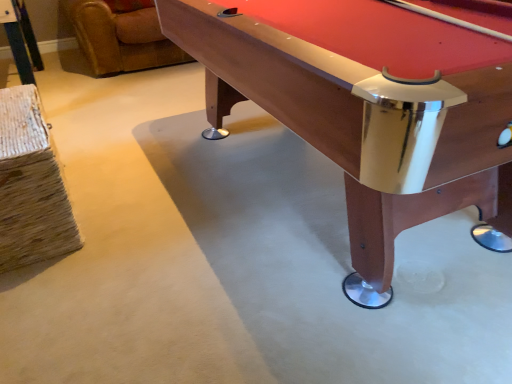
The image size is (512, 384). In order to click on wooden pool table at center in this screenshot , I will do `click(366, 110)`.

What do you see at coordinates (366, 110) in the screenshot? The height and width of the screenshot is (384, 512). I see `wooden pool table at center` at bounding box center [366, 110].

This screenshot has width=512, height=384. Find the location of `brown leather swivel chair at upper left`. brown leather swivel chair at upper left is located at coordinates (121, 35).

This screenshot has width=512, height=384. Describe the element at coordinates (121, 35) in the screenshot. I see `brown leather swivel chair at upper left` at that location.

Locate an element on the screen. Image resolution: width=512 pixels, height=384 pixels. wooden pool table at center is located at coordinates (366, 110).

Considering the relative positions of wooden pool table at center and brown leather swivel chair at upper left in the image provided, is wooden pool table at center to the left or to the right of brown leather swivel chair at upper left?

Clearly, wooden pool table at center is on the right of brown leather swivel chair at upper left in the image.

In the image, is wooden pool table at center positioned in front of or behind brown leather swivel chair at upper left?

wooden pool table at center is positioned closer to the viewer than brown leather swivel chair at upper left.

Between point (286, 4) and point (84, 11), which one is positioned in front?

The point (286, 4) is closer.

From the image's perspective, relative to brown leather swivel chair at upper left, is wooden pool table at center above or below?

Based on their image positions, wooden pool table at center is located beneath brown leather swivel chair at upper left.

From a real-world perspective, which object stands above the other?

From a 3D spatial view, wooden pool table at center is above.

Can you confirm if wooden pool table at center is wider than brown leather swivel chair at upper left?

In fact, wooden pool table at center might be narrower than brown leather swivel chair at upper left.

From the picture: Considering the sizes of objects wooden pool table at center and brown leather swivel chair at upper left in the image provided, who is shorter, wooden pool table at center or brown leather swivel chair at upper left?

brown leather swivel chair at upper left is shorter.

Considering the sizes of objects wooden pool table at center and brown leather swivel chair at upper left in the image provided, who is smaller, wooden pool table at center or brown leather swivel chair at upper left?

Smaller between the two is brown leather swivel chair at upper left.

Choose the correct answer: Is wooden pool table at center inside brown leather swivel chair at upper left or outside it?

wooden pool table at center is outside brown leather swivel chair at upper left.

Is wooden pool table at center touching brown leather swivel chair at upper left?

There is a gap between wooden pool table at center and brown leather swivel chair at upper left.

From the picture: Does wooden pool table at center turn towards brown leather swivel chair at upper left?

No, wooden pool table at center is not aimed at brown leather swivel chair at upper left.

What's the angular difference between wooden pool table at center and brown leather swivel chair at upper left's facing directions?

There is a 90.6-degree angle between the facing directions of wooden pool table at center and brown leather swivel chair at upper left.

How far apart are wooden pool table at center and brown leather swivel chair at upper left?

wooden pool table at center is 2.07 meters from brown leather swivel chair at upper left.

Where is `billiard table on the right of brown leather swivel chair at upper left`? This screenshot has height=384, width=512. billiard table on the right of brown leather swivel chair at upper left is located at coordinates (366, 110).

From the picture: Is brown leather swivel chair at upper left at the right side of wooden pool table at center?

Incorrect, brown leather swivel chair at upper left is not on the right side of wooden pool table at center.

In the scene shown: Is brown leather swivel chair at upper left closer to camera compared to wooden pool table at center?

No, brown leather swivel chair at upper left is further to the viewer.

Does point (88, 31) appear closer or farther from the camera than point (312, 130)?

Point (88, 31) is positioned farther from the camera compared to point (312, 130).

From the image's perspective, is brown leather swivel chair at upper left located above or below wooden pool table at center?

brown leather swivel chair at upper left is situated higher than wooden pool table at center in the image.

From a real-world perspective, which object stands above the other?

In real-world perspective, wooden pool table at center is above.

Considering the relative sizes of brown leather swivel chair at upper left and wooden pool table at center in the image provided, is brown leather swivel chair at upper left wider than wooden pool table at center?

Yes, brown leather swivel chair at upper left is wider than wooden pool table at center.

Can you confirm if brown leather swivel chair at upper left is taller than wooden pool table at center?

No, brown leather swivel chair at upper left is not taller than wooden pool table at center.

Based on the photo, does brown leather swivel chair at upper left have a smaller size compared to wooden pool table at center?

Indeed, brown leather swivel chair at upper left has a smaller size compared to wooden pool table at center.

Would you say brown leather swivel chair at upper left contains wooden pool table at center?

Definitely not — wooden pool table at center is not inside brown leather swivel chair at upper left.

Is brown leather swivel chair at upper left far from wooden pool table at center?

Absolutely, brown leather swivel chair at upper left is distant from wooden pool table at center.

Is wooden pool table at center at the back of brown leather swivel chair at upper left?

No.

Find the location of a particular element. This screenshot has width=512, height=384. swivel chair on the left of wooden pool table at center is located at coordinates (121, 35).

Identify the location of billiard table below the brown leather swivel chair at upper left (from the image's perspective). This screenshot has width=512, height=384. (366, 110).

This screenshot has height=384, width=512. In the image, there is a wooden pool table at center. Identify the location of swivel chair below it (from a real-world perspective). (121, 35).